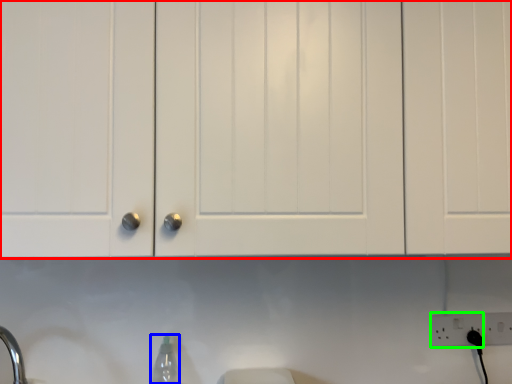
Question: Based on their relative distances, which object is farther from cabinetry (highlighted by a red box)? Choose from bottle (highlighted by a blue box) and electric outlet (highlighted by a green box).

Choices:
 (A) bottle
 (B) electric outlet

Answer: (B)